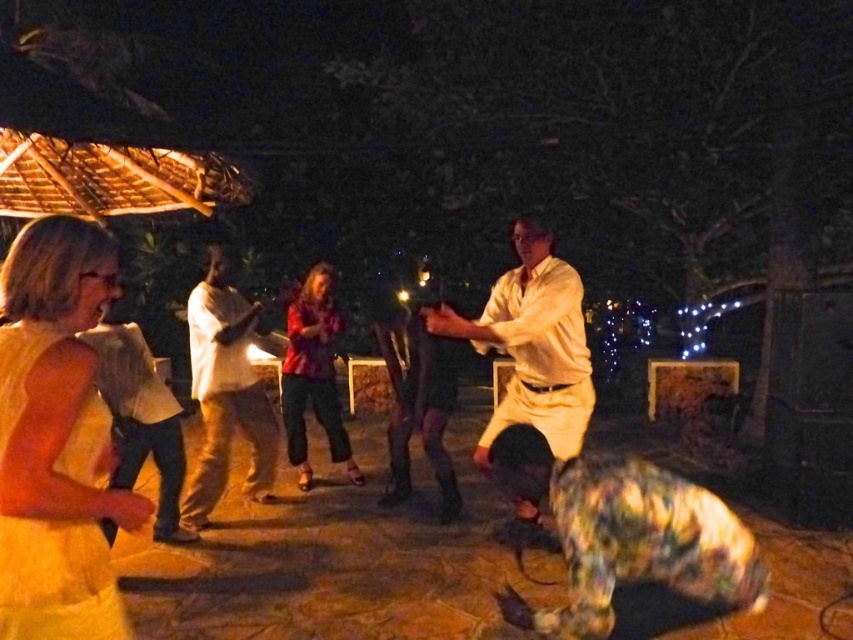
You are a photographer at the party and want to take a photo of both the light brown leather jacket at left and the printed cotton blouse at center. Which object should you focus on first if you want to capture both in the same frame without moving the camera?

You should focus on the light brown leather jacket at left first because it is positioned under the printed cotton blouse at center, meaning it is closer to the camera. By focusing on the closer object, both will be in focus if they are within the camera lens depth of field.

You are organizing a coat rack for guests at the party. You have a light brown leather jacket at left and a printed cotton blouse at center. Which item requires more space on the coat rack?

The light brown leather jacket at left requires more space on the coat rack because it is larger in size than the printed cotton blouse at center.